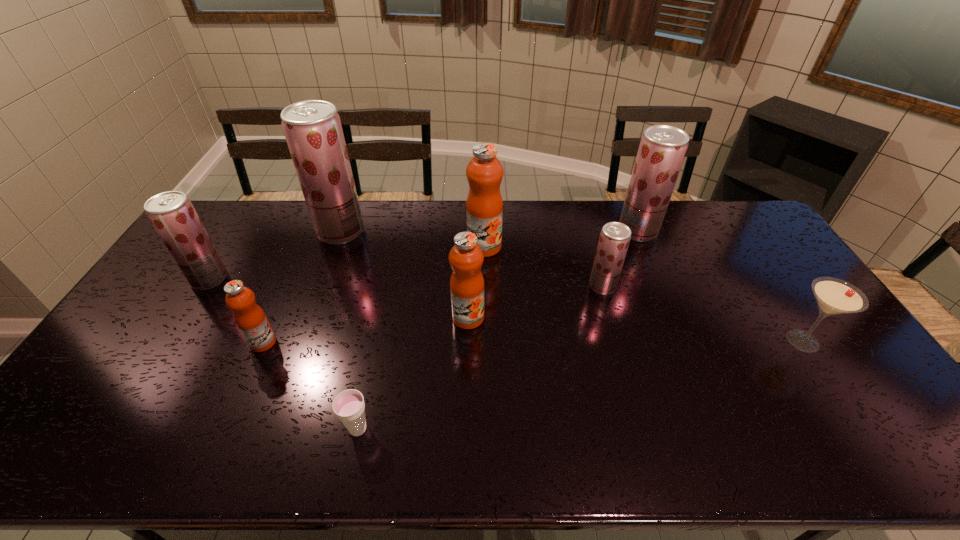
Image resolution: width=960 pixels, height=540 pixels. In the image, there is a desktop. In order to click on free region at the left edge in this screenshot , I will do `click(126, 322)`.

In the image, there is a desktop. Identify the location of vacant space at the far left corner. Image resolution: width=960 pixels, height=540 pixels. (213, 220).

Find the location of a particular element. vacant space at the far right corner of the desktop is located at coordinates [711, 207].

You are a GUI agent. You are given a task and a screenshot of the screen. Output one action in this format:
    pyautogui.click(x=<x>, y=<y>)
    Task: Click on the vacant space that's between the sixth fruit juice from left to right and the rightmost object
    
    Given the screenshot: What is the action you would take?
    pyautogui.click(x=703, y=314)

Locate an element on the screen. empty location between the tallest fruit juice and the farthest orange fruit juice is located at coordinates (413, 239).

I want to click on blank region between the rightmost object and the second fruit juice from right to left, so click(703, 314).

The image size is (960, 540). What are the coordinates of `vacant point located between the second strawberry fruit juice from left to right and the second biggest orange fruit juice` in the screenshot? It's located at (404, 274).

Locate an element on the screen. This screenshot has height=540, width=960. vacant space that's between the second smallest orange fruit juice and the sixth fruit juice from left to right is located at coordinates (x=536, y=302).

You are a GUI agent. You are given a task and a screenshot of the screen. Output one action in this format:
    pyautogui.click(x=<x>, y=<y>)
    Task: Click on the free space between the leftmost strawberry fruit juice and the biggest orange fruit juice
    The image size is (960, 540).
    Given the screenshot: What is the action you would take?
    pyautogui.click(x=347, y=263)

Where is `vacant space in between the second nearest orange fruit juice and the eighth object from left to right`? vacant space in between the second nearest orange fruit juice and the eighth object from left to right is located at coordinates (553, 274).